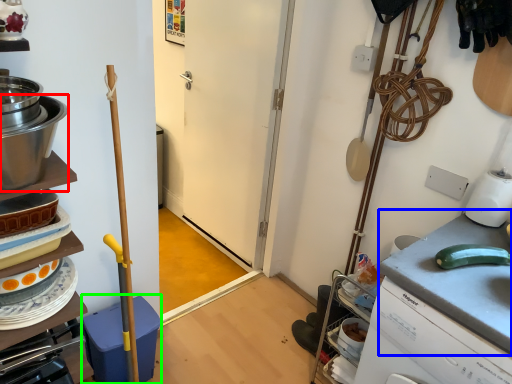
Question: Estimate the real-world distances between objects in this image. Which object is farther from kitchen appliance (highlighted by a red box), counter top (highlighted by a blue box) or dish washer (highlighted by a green box)?

Choices:
 (A) counter top
 (B) dish washer

Answer: (A)